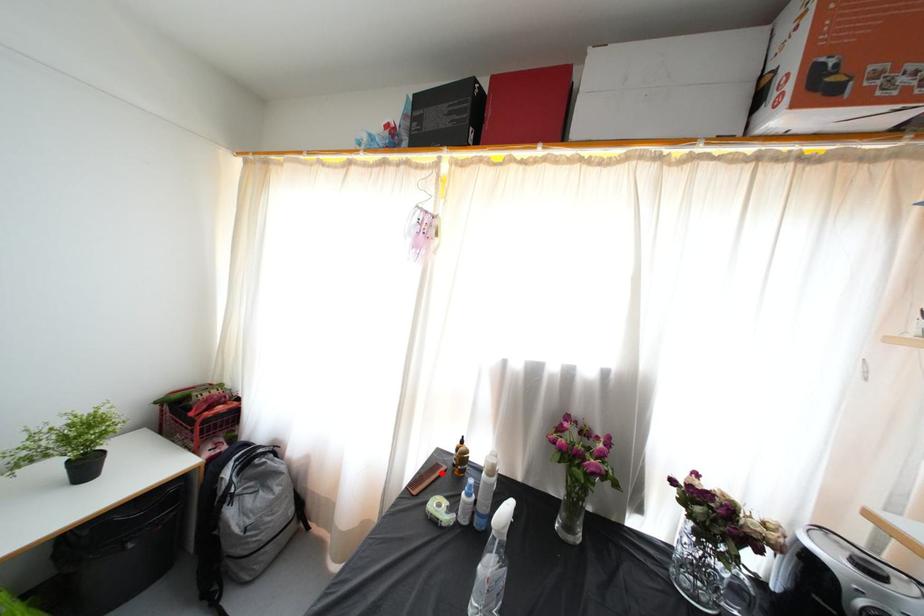
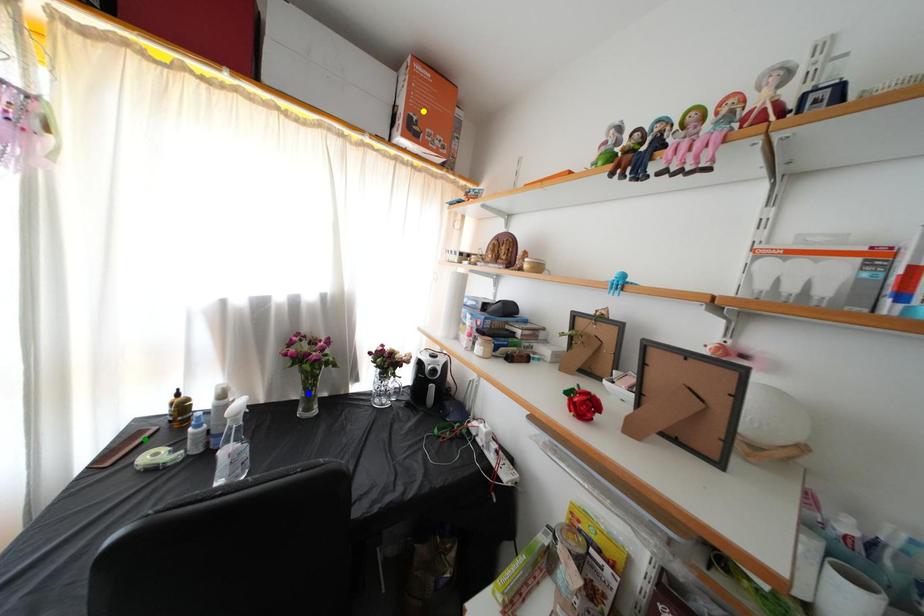
Question: I am providing you with two images of the same scene from different viewpoints. A red point is marked on the first image. You are given multiple points on the second image. Which point in image 2 represents the same 3d spot as the red point in image 1?

Choices:
 (A) yellow point
 (B) blue point
 (C) green point

Answer: (C)